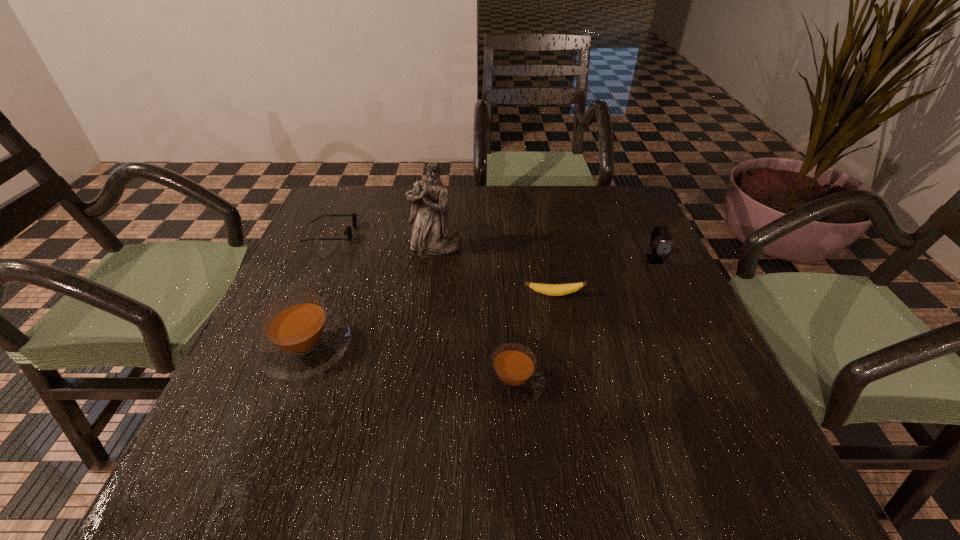
Identify the location of vacant space at the far edge of the desktop. The image size is (960, 540). (393, 230).

What are the coordinates of `vacant space at the near edge` in the screenshot? It's located at (444, 412).

Identify the location of free point at the left edge. Image resolution: width=960 pixels, height=540 pixels. pyautogui.click(x=342, y=234).

Identify the location of free space at the right edge of the desktop. (649, 242).

The height and width of the screenshot is (540, 960). What are the coordinates of `vacant point at the far left corner` in the screenshot? It's located at (347, 221).

In the image, there is a desktop. What are the coordinates of `free space at the far right corner` in the screenshot? It's located at (612, 185).

This screenshot has width=960, height=540. In order to click on empty space between the figurine and the rightmost object in this screenshot , I will do `click(545, 254)`.

Locate an element on the screen. This screenshot has height=540, width=960. vacant point located between the figurine and the watch is located at coordinates (545, 254).

You are a GUI agent. You are given a task and a screenshot of the screen. Output one action in this format:
    pyautogui.click(x=<x>, y=<y>)
    Task: Click on the empty location between the tallest object and the third nearest object
    This screenshot has height=540, width=960.
    Given the screenshot: What is the action you would take?
    pyautogui.click(x=494, y=271)

Identify the location of unoccupied position between the sunglasses and the taller cappuccino. The height and width of the screenshot is (540, 960). (318, 291).